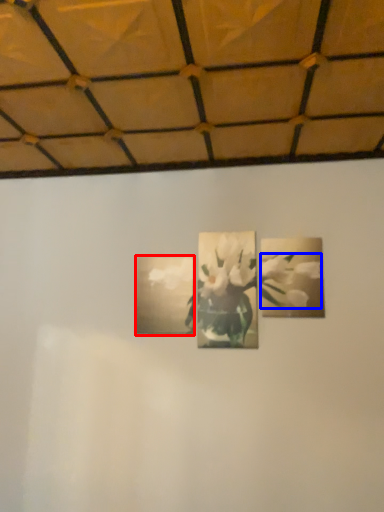
Question: Which object is further to the camera taking this photo, picture frame (highlighted by a red box) or flower (highlighted by a blue box)?

Choices:
 (A) picture frame
 (B) flower

Answer: (A)